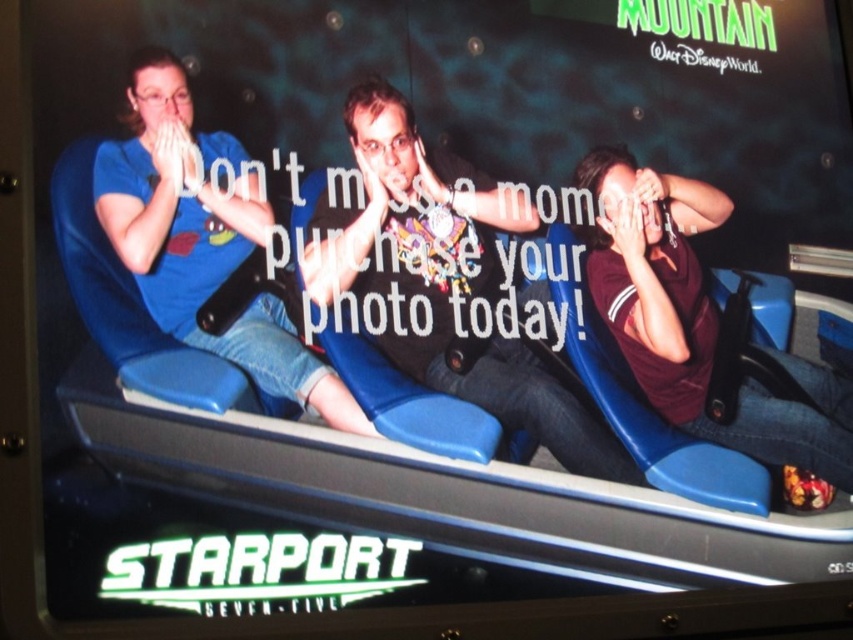
Does point (517, 394) come behind point (598, 163)?

No, it is in front of (598, 163).

Which is behind, point (405, 179) or point (664, 378)?

The point (664, 378) is behind.

This screenshot has width=853, height=640. I want to click on matte black shirt at center, so click(448, 284).

Can you confirm if matte blue jeans at left is positioned below maroon jersey at right?

No, matte blue jeans at left is not below maroon jersey at right.

Consider the image. Does matte blue jeans at left have a greater width compared to maroon jersey at right?

In fact, matte blue jeans at left might be narrower than maroon jersey at right.

Between point (120, 237) and point (602, 275), which one is positioned in front?

Positioned in front is point (120, 237).

At what (x,y) coordinates should I click in order to perform the action: click on matte blue jeans at left. Please return your answer as a coordinate pair (x, y). The width and height of the screenshot is (853, 640). Looking at the image, I should click on (207, 243).

Is matte black shirt at center behind matte blue jeans at left?

Yes, it is behind matte blue jeans at left.

Is point (364, 243) closer to viewer compared to point (213, 221)?

No, it is not.

Is point (463, 376) more distant than point (258, 168)?

That is True.

The width and height of the screenshot is (853, 640). Identify the location of matte black shirt at center. (448, 284).